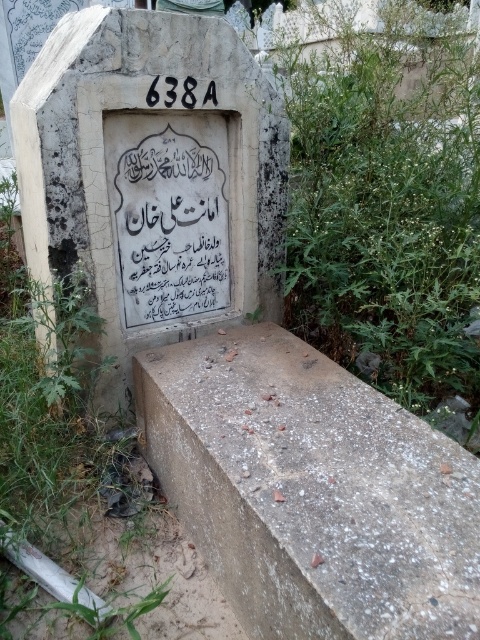
Can you confirm if gray concrete at lower center is bigger than green leafy plant at lower right?

No.

How much distance is there between gray concrete at lower center and green leafy plant at lower right?

The distance of gray concrete at lower center from green leafy plant at lower right is 24.53 inches.

This screenshot has width=480, height=640. What do you see at coordinates (311, 490) in the screenshot?
I see `gray concrete at lower center` at bounding box center [311, 490].

Where is `gray concrete at lower center`? gray concrete at lower center is located at coordinates pyautogui.click(x=311, y=490).

Which is above, white stone gravestone at center or green leafy plant at lower right?

green leafy plant at lower right is higher up.

Is point (96, 340) more distant than point (427, 172)?

That is False.

Where is `white stone gravestone at center`? The image size is (480, 640). white stone gravestone at center is located at coordinates (153, 177).

Is gray concrete at lower center further to camera compared to white stone gravestone at center?

No, it is in front of white stone gravestone at center.

Does point (276, 344) come farther from viewer compared to point (79, 29)?

Yes, it is.

Which is in front, point (197, 371) or point (253, 294)?

Point (197, 371) is in front.

Find the location of a particular element. gray concrete at lower center is located at coordinates (311, 490).